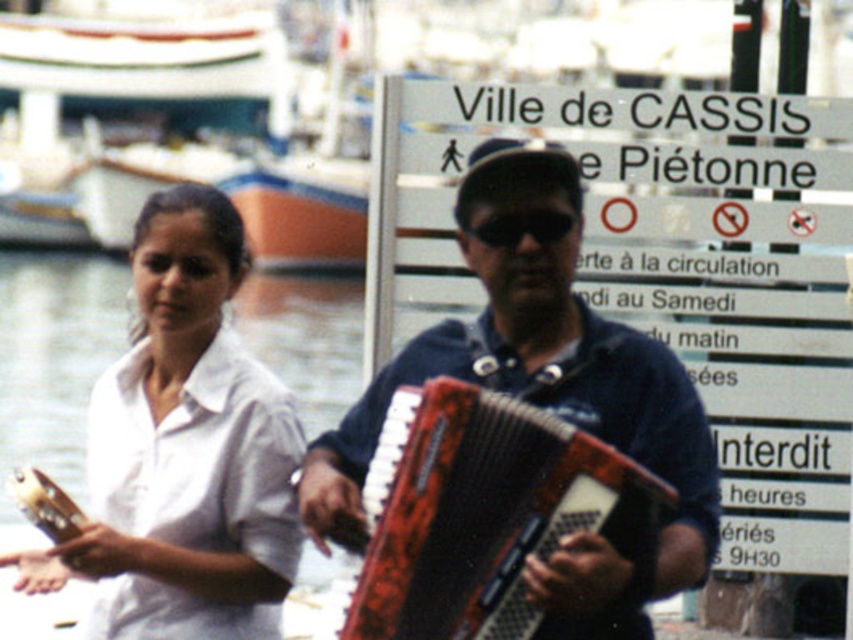
Can you confirm if wooden accordion at center is taller than rusty metal accordion at center?

Yes.

Does wooden accordion at center have a lesser height compared to rusty metal accordion at center?

Incorrect, wooden accordion at center's height does not fall short of rusty metal accordion at center's.

In order to click on wooden accordion at center in this screenshot , I will do `click(538, 369)`.

Is white matte shirt at upper left closer to the viewer compared to black matte sunglasses at center?

No, it is not.

Can you confirm if white matte shirt at upper left is positioned to the left of black matte sunglasses at center?

Indeed, white matte shirt at upper left is positioned on the left side of black matte sunglasses at center.

Which is behind, point (283, 490) or point (549, 241)?

The point (283, 490) is behind.

The width and height of the screenshot is (853, 640). In order to click on white matte shirt at upper left in this screenshot , I will do `click(183, 451)`.

Is rusty metal accordion at center thinner than black matte sunglasses at center?

No.

Looking at this image, is rusty metal accordion at center to the right of black matte sunglasses at center from the viewer's perspective?

In fact, rusty metal accordion at center is to the left of black matte sunglasses at center.

Which is in front, point (485, 552) or point (535, 228)?

Positioned in front is point (485, 552).

Find the location of a particular element. The width and height of the screenshot is (853, 640). rusty metal accordion at center is located at coordinates (485, 513).